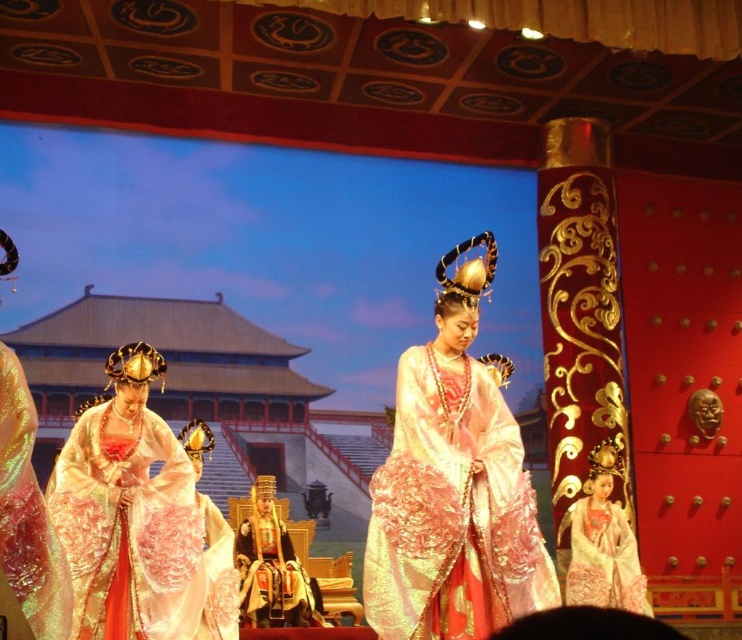
Question: Does silky white gown at center have a greater width compared to silk embroidered robe at center?

Choices:
 (A) no
 (B) yes

Answer: (B)

Question: Which point is farther to the camera?

Choices:
 (A) silky pink gown at center
 (B) silk embroidered robe at center

Answer: (B)

Question: Can you confirm if shiny gold dress at center is positioned to the left of silk embroidered robe at center?

Choices:
 (A) no
 (B) yes

Answer: (B)

Question: Can you confirm if silky pink gown at center is positioned to the right of silky white gown at center?

Choices:
 (A) yes
 (B) no

Answer: (B)

Question: Estimate the real-world distances between objects in this image. Which object is closer to the iridescent silk dress at left?

Choices:
 (A) silky pink gown at center
 (B) shiny gold dress at center
 (C) silky white gown at center
 (D) silk embroidered robe at center

Answer: (B)

Question: Which point is closer to the camera taking this photo?

Choices:
 (A) (410, 563)
 (B) (584, 488)
 (C) (47, 560)
 (D) (114, 378)

Answer: (C)